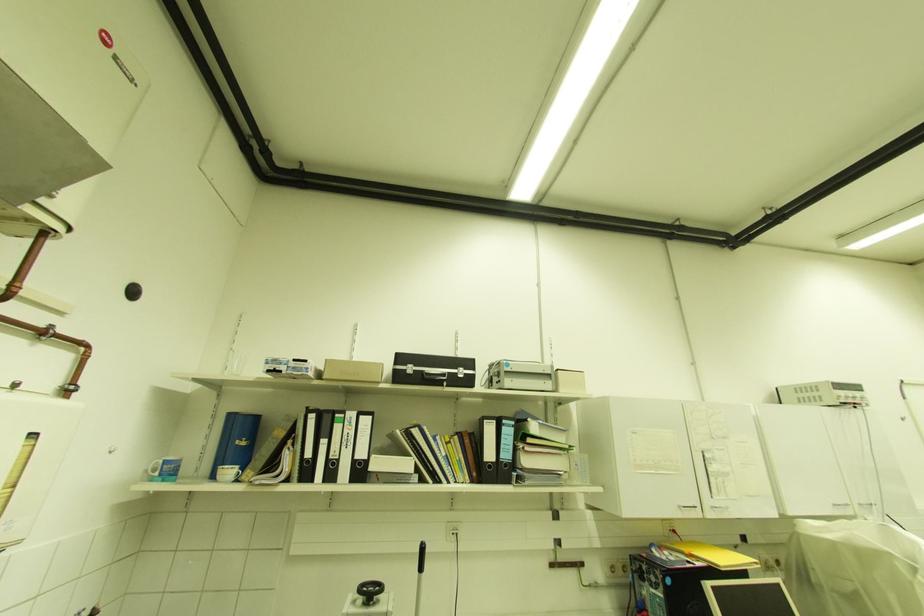
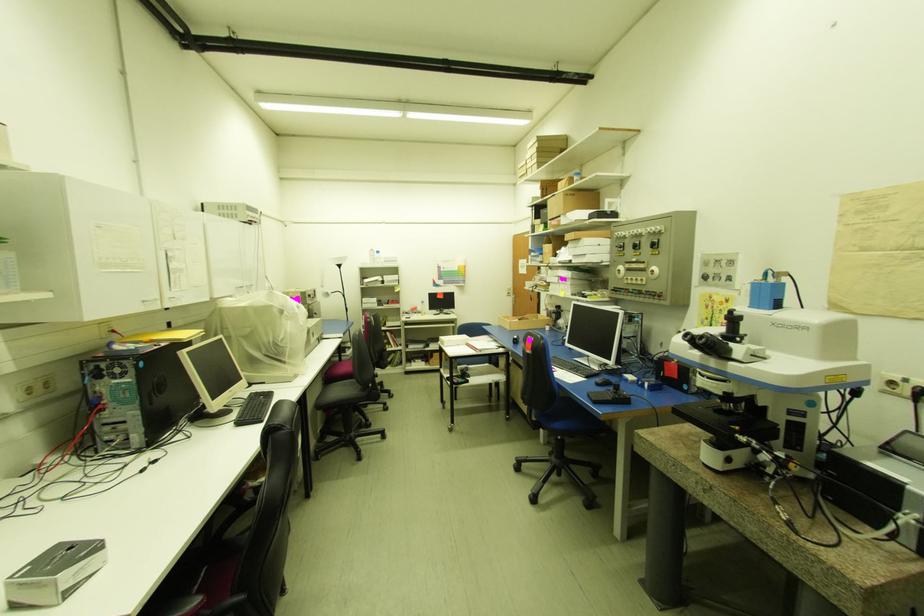
Question: The images are taken continuously from a first-person perspective. In which direction is your viewpoint rotating?

Choices:
 (A) Left
 (B) Right
 (C) Up
 (D) Down

Answer: (B)